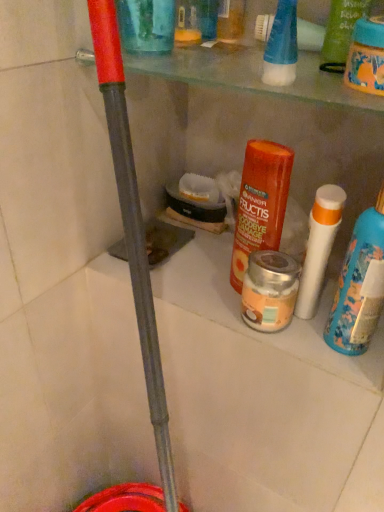
Question: Is orange matte haircare product at center, which appears as the second product when viewed from the left, bigger than white matte bottle at right?

Choices:
 (A) no
 (B) yes

Answer: (A)

Question: Is orange matte haircare product at center, which appears as the second product when viewed from the left, outside of white matte bottle at right?

Choices:
 (A) yes
 (B) no

Answer: (A)

Question: Is the depth of orange matte haircare product at center, which appears as the second product when viewed from the left, greater than that of white matte bottle at right?

Choices:
 (A) no
 (B) yes

Answer: (B)

Question: Is orange matte haircare product at center, which appears as the second product when viewed from the left, next to white matte bottle at right?

Choices:
 (A) no
 (B) yes

Answer: (A)

Question: Is orange matte haircare product at center, which appears as the second product when viewed from the left, oriented away from white matte bottle at right?

Choices:
 (A) no
 (B) yes

Answer: (A)

Question: From a real-world perspective, relative to transparent plastic cup at upper center, placed as the fourth product when sorted from right to left, is silver metallic jar at center, which is the third product from left to right, vertically above or below?

Choices:
 (A) above
 (B) below

Answer: (B)

Question: From their relative heights in the image, would you say silver metallic jar at center, which is the third product from left to right, is taller or shorter than transparent plastic cup at upper center, placed as the fourth product when sorted from right to left?

Choices:
 (A) short
 (B) tall

Answer: (A)

Question: Is silver metallic jar at center, the 2th product in the right-to-left sequence, in front of or behind transparent plastic cup at upper center, placed as the fourth product when sorted from right to left, in the image?

Choices:
 (A) behind
 (B) front

Answer: (A)

Question: Considering the positions of point tap(253, 292) and point tap(162, 22), is point tap(253, 292) closer or farther from the camera than point tap(162, 22)?

Choices:
 (A) farther
 (B) closer

Answer: (A)

Question: Looking at the image, does white matte bottle at right seem bigger or smaller compared to orange matte haircare product at center, which appears as the second product when viewed from the left?

Choices:
 (A) small
 (B) big

Answer: (B)

Question: Relative to orange matte haircare product at center, which is counted as the 3th product, starting from the right, is white matte bottle at right in front or behind?

Choices:
 (A) front
 (B) behind

Answer: (A)

Question: Is white matte bottle at right to the left or to the right of orange matte haircare product at center, which appears as the second product when viewed from the left, in the image?

Choices:
 (A) right
 (B) left

Answer: (A)

Question: Looking at their shapes, would you say white matte bottle at right is wider or thinner than orange matte haircare product at center, which appears as the second product when viewed from the left?

Choices:
 (A) wide
 (B) thin

Answer: (A)

Question: In the image, is silver metallic jar at center, the 2th product in the right-to-left sequence, positioned in front of or behind white matte bottle at right?

Choices:
 (A) behind
 (B) front

Answer: (A)

Question: Is silver metallic jar at center, which is the third product from left to right, to the left or to the right of white matte bottle at right in the image?

Choices:
 (A) left
 (B) right

Answer: (A)